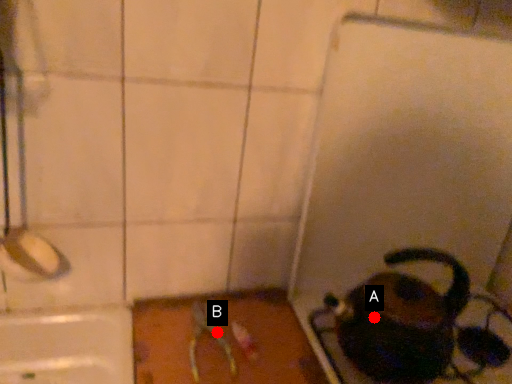
Question: Two points are circled on the image, labeled by A and B beside each circle. Among these points, which one is nearest to the camera?

Choices:
 (A) A is closer
 (B) B is closer

Answer: (A)